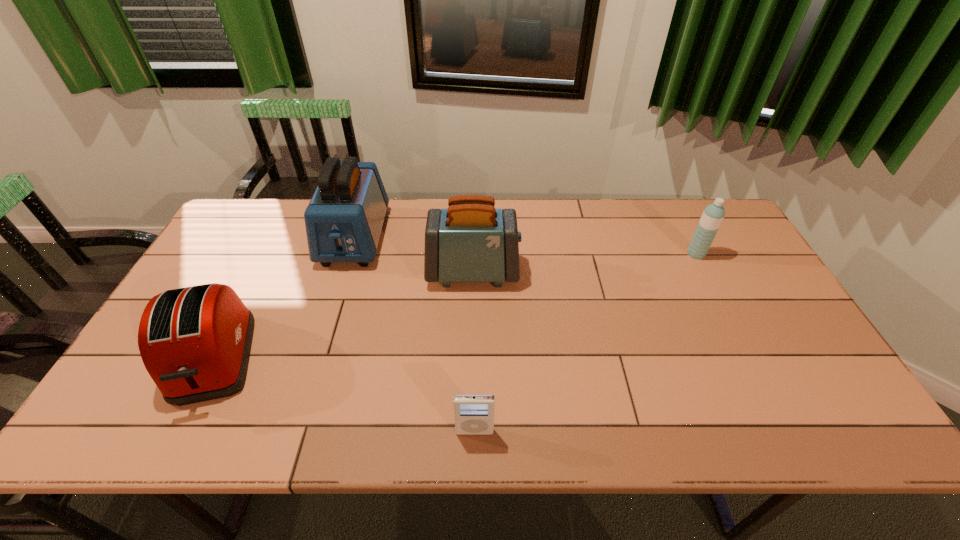
You are a GUI agent. You are given a task and a screenshot of the screen. Output one action in this format:
    pyautogui.click(x=<x>, y=<y>)
    Task: Click on the fourth object from right to left
    
    Given the screenshot: What is the action you would take?
    pyautogui.click(x=344, y=219)

You are a GUI agent. You are given a task and a screenshot of the screen. Output one action in this format:
    pyautogui.click(x=<x>, y=<y>)
    Task: Click on the rightmost toaster
    
    Given the screenshot: What is the action you would take?
    pyautogui.click(x=471, y=241)

The height and width of the screenshot is (540, 960). I want to click on the rightmost object, so click(x=713, y=215).

The height and width of the screenshot is (540, 960). In order to click on the leftmost object in this screenshot , I will do `click(195, 342)`.

Locate an element on the screen. This screenshot has width=960, height=540. the shortest toaster is located at coordinates (195, 342).

This screenshot has width=960, height=540. I want to click on the nearest object, so click(474, 413).

Identify the location of the shortest object. (474, 413).

This screenshot has width=960, height=540. I want to click on free spot located 0.140m on the front-facing side of the second toaster from right to left, so click(333, 307).

Locate an element on the screen. Image resolution: width=960 pixels, height=540 pixels. vacant space situated on the front-facing side of the rightmost toaster is located at coordinates (559, 272).

Where is `vacant space situated 0.250m on the front of the water bottle`? vacant space situated 0.250m on the front of the water bottle is located at coordinates (732, 325).